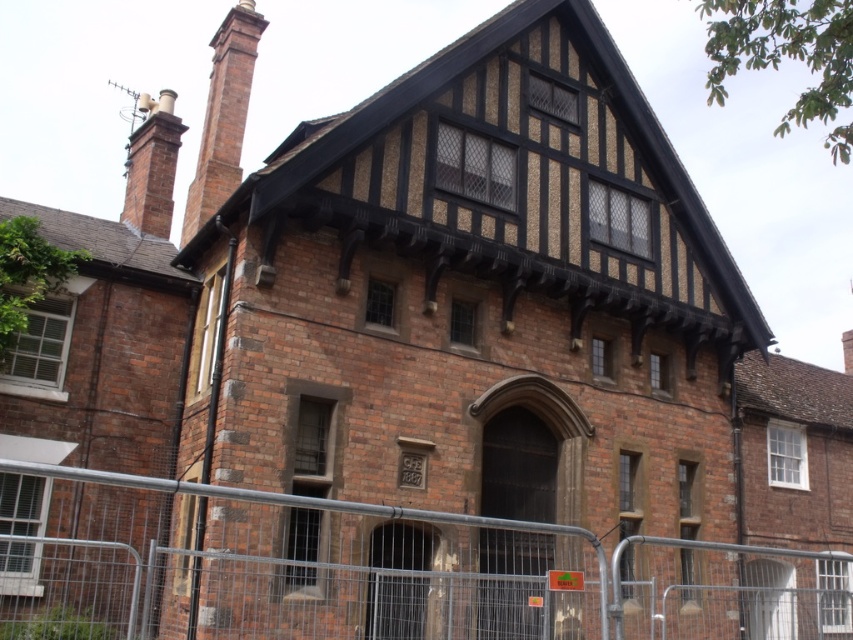
Question: From the image, what is the correct spatial relationship of red brick chimney at upper left in relation to brick chimney at upper left?

Choices:
 (A) left
 (B) right

Answer: (B)

Question: Which point is farther to the camera?

Choices:
 (A) metal fence at center
 (B) brick chimney at upper left

Answer: (B)

Question: Which point is closer to the camera?

Choices:
 (A) (152, 147)
 (B) (227, 157)
 (C) (350, 554)

Answer: (C)

Question: Is metal fence at center thinner than brick chimney at upper left?

Choices:
 (A) yes
 (B) no

Answer: (B)

Question: Which object is the closest to the metal fence at center?

Choices:
 (A) red brick chimney at upper left
 (B) brick chimney at upper left

Answer: (A)

Question: Can you confirm if metal fence at center is positioned to the right of red brick chimney at upper left?

Choices:
 (A) no
 (B) yes

Answer: (B)